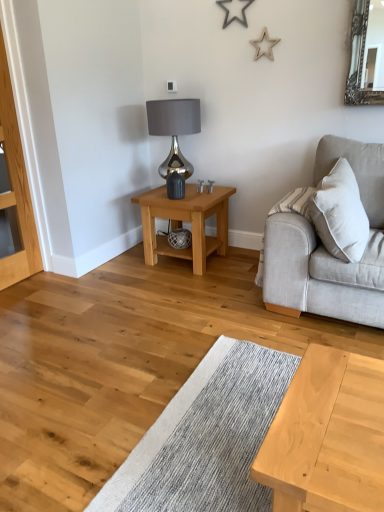
Identify the location of free space in front of light oak dresser at left. The width and height of the screenshot is (384, 512). (22, 298).